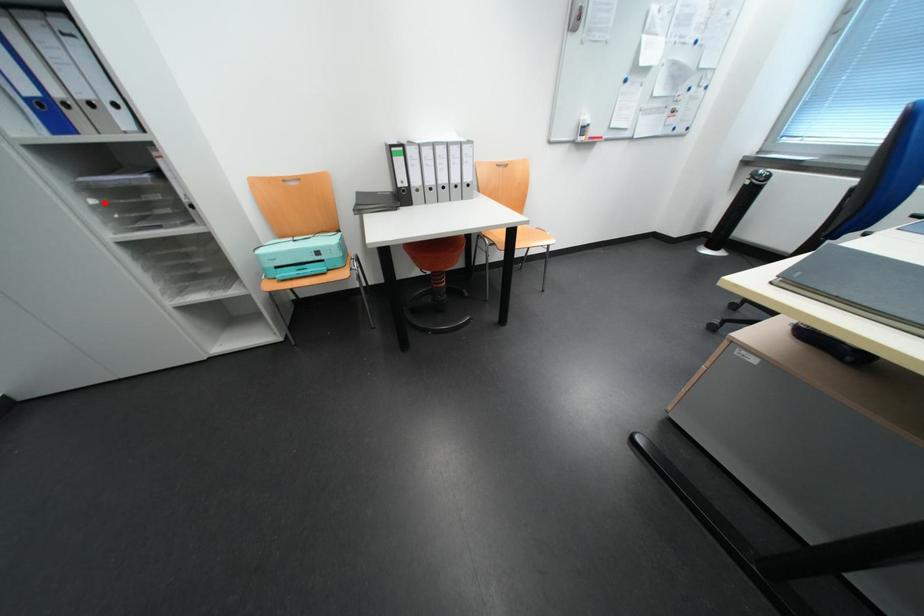
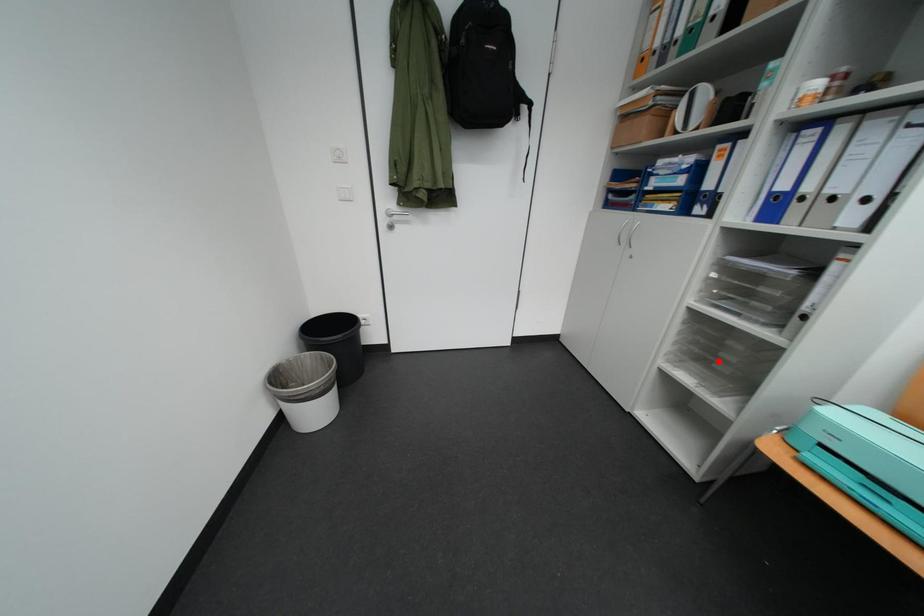
I am providing you with two images of the same scene from different viewpoints. A red point is marked on the first image and another point is marked on the second image. Do the highlighted points in image1 and image2 indicate the same real-world spot?

No